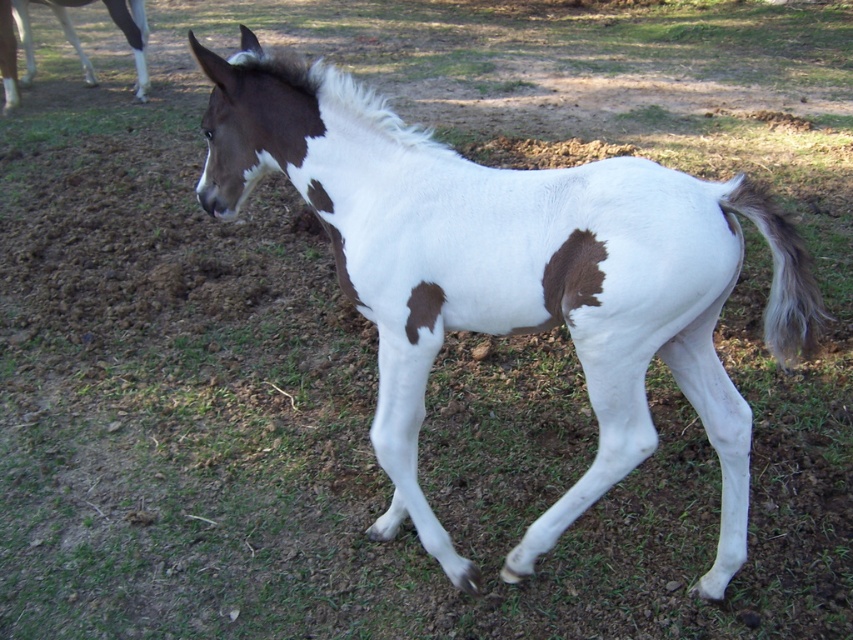
Is white silky tail at right positioned before white glossy leg at upper left?

Yes, white silky tail at right is in front of white glossy leg at upper left.

Can you confirm if white silky tail at right is positioned below white glossy leg at upper left?

Indeed, white silky tail at right is positioned under white glossy leg at upper left.

What do you see at coordinates (780, 273) in the screenshot? I see `white silky tail at right` at bounding box center [780, 273].

Where is `white silky tail at right`? This screenshot has width=853, height=640. white silky tail at right is located at coordinates (780, 273).

Who is positioned more to the right, white glossy horse at center or brown fuzzy patch at lower right?

brown fuzzy patch at lower right is more to the right.

The image size is (853, 640). I want to click on white glossy horse at center, so click(x=509, y=275).

At what (x,y) coordinates should I click in order to perform the action: click on white glossy horse at center. Please return your answer as a coordinate pair (x, y). Image resolution: width=853 pixels, height=640 pixels. Looking at the image, I should click on (509, 275).

Which is more to the left, white silky tail at right or brown fuzzy patch at lower right?

brown fuzzy patch at lower right is more to the left.

Is white silky tail at right above brown fuzzy patch at lower right?

Yes.

Locate an element on the screen. Image resolution: width=853 pixels, height=640 pixels. white silky tail at right is located at coordinates (780, 273).

Identify the location of white silky tail at right. The height and width of the screenshot is (640, 853). (780, 273).